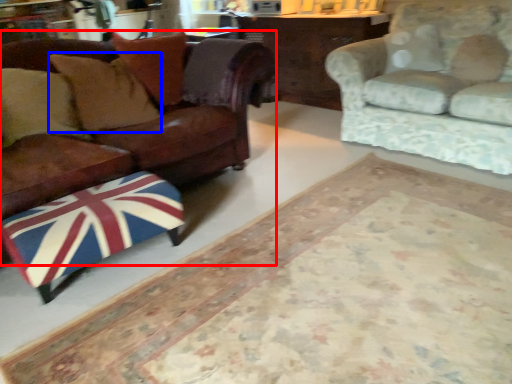
Question: Which of the following is the closest to the observer, studio couch (highlighted by a red box) or pillow (highlighted by a blue box)?

Choices:
 (A) studio couch
 (B) pillow

Answer: (A)